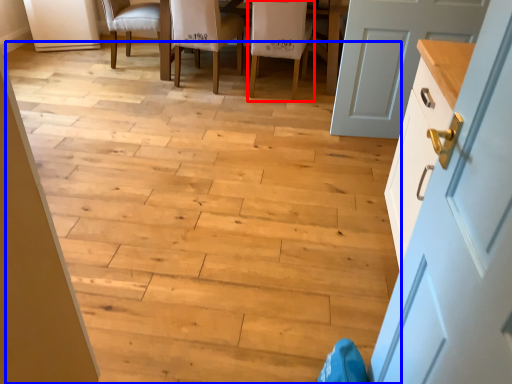
Question: Which object appears farthest to the camera in this image, chair (highlighted by a red box) or stair (highlighted by a blue box)?

Choices:
 (A) chair
 (B) stair

Answer: (A)